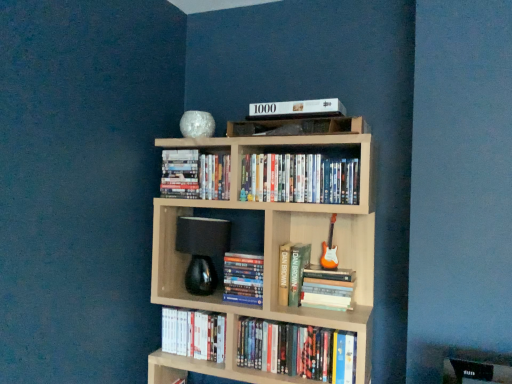
Locate an element on the screen. empty space that is ontop of black glass lamp at center (from a real-world perspective) is located at coordinates (201, 217).